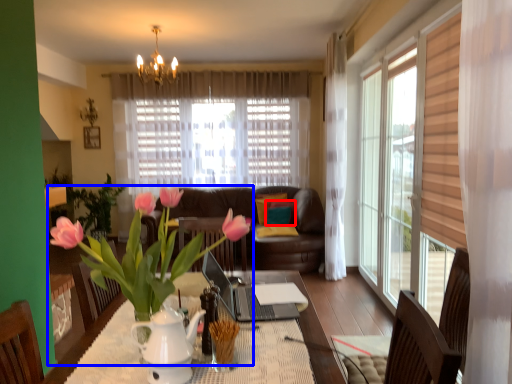
Question: Which point is further to the camera, pillow (highlighted by a red box) or houseplant (highlighted by a blue box)?

Choices:
 (A) pillow
 (B) houseplant

Answer: (A)